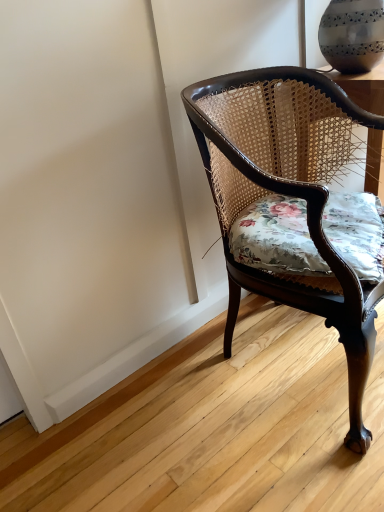
This screenshot has height=512, width=384. Identify the location of mahogany cane chair at center. (x=290, y=193).

What is the approximate height of mahogany cane chair at center?

mahogany cane chair at center is 31.65 inches tall.

Describe the element at coordinates (290, 193) in the screenshot. The height and width of the screenshot is (512, 384). I see `mahogany cane chair at center` at that location.

This screenshot has height=512, width=384. I want to click on mahogany cane chair at center, so click(x=290, y=193).